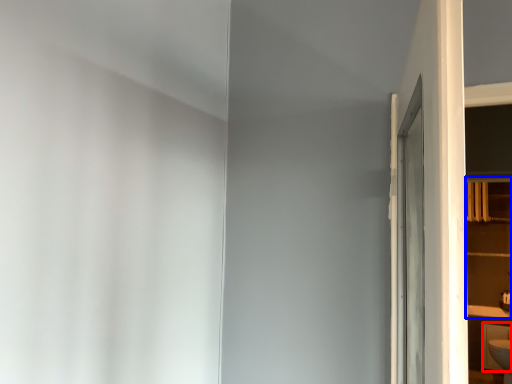
Question: Which of the following is the closest to the observer, cabinetry (highlighted by a red box) or shelf (highlighted by a blue box)?

Choices:
 (A) cabinetry
 (B) shelf

Answer: (B)